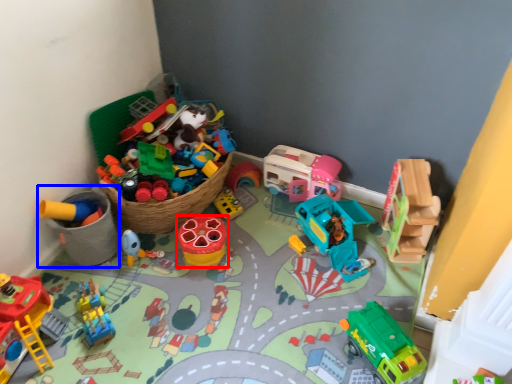
Question: Which object is further to the camera taking this photo, toy (highlighted by a red box) or toy (highlighted by a blue box)?

Choices:
 (A) toy
 (B) toy

Answer: (A)